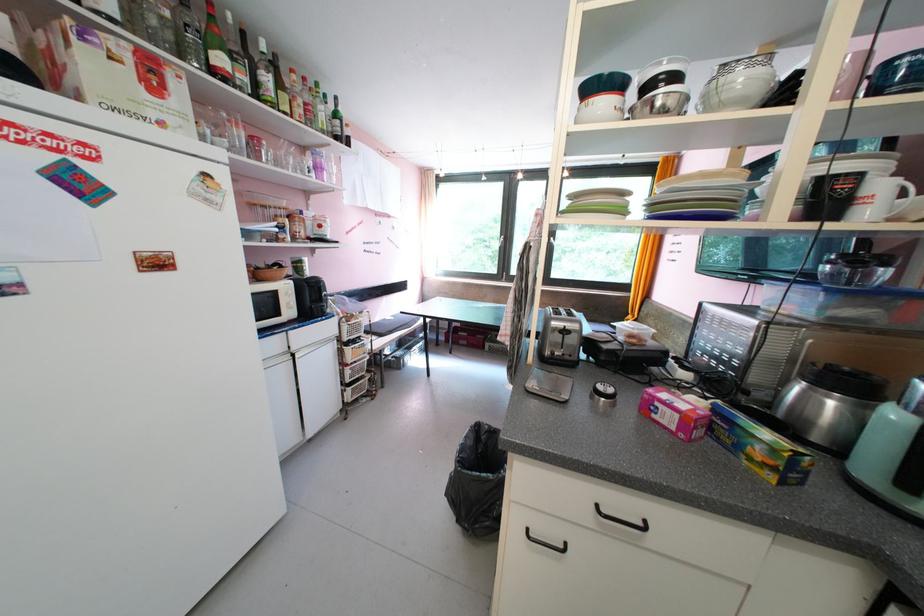
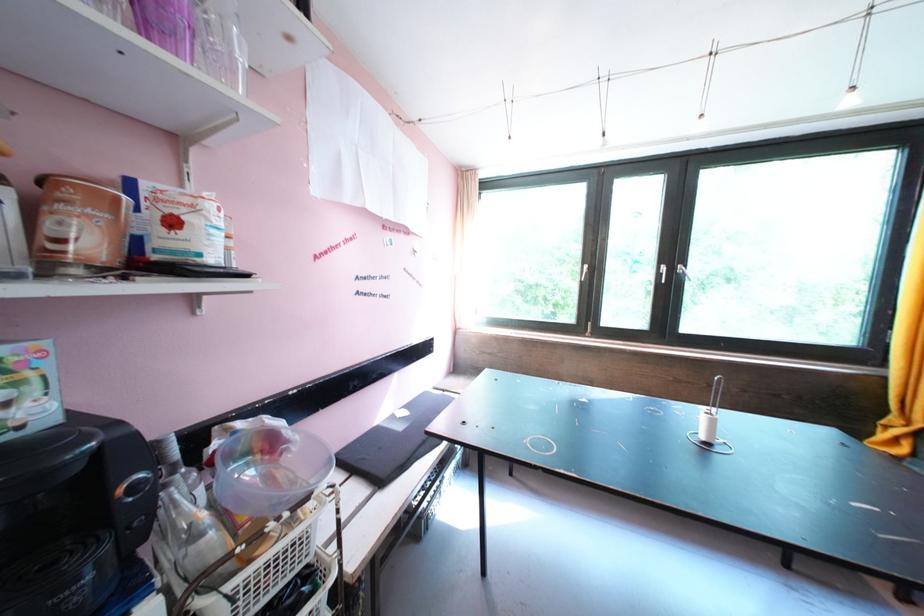
The point at (306, 222) is marked in the first image. Where is the corresponding point in the second image?

(78, 196)